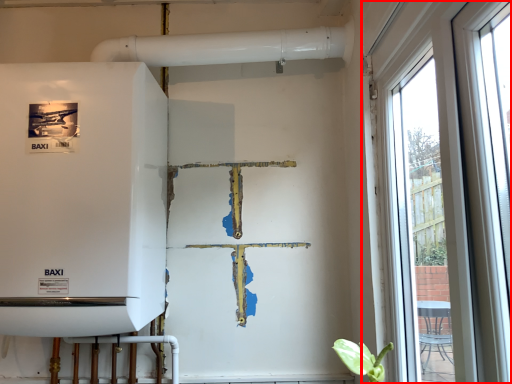
Question: In this image, where is window (annotated by the red box) located relative to appliance?

Choices:
 (A) left
 (B) right

Answer: (B)